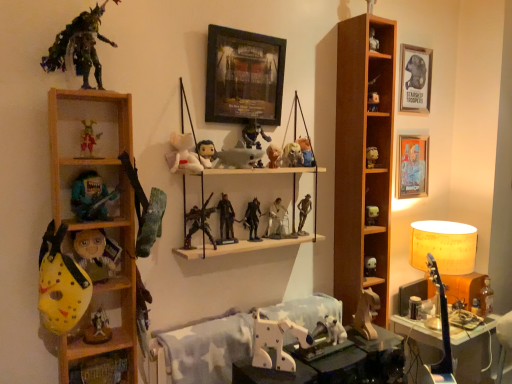
Question: Considering the relative sizes of white plastic walker at center, which ranks as the eleventh toy in bottom-to-top order, and matte plastic skull at center, which is counted as the 20th toy, starting from the bottom, in the image provided, is white plastic walker at center, which ranks as the eleventh toy in bottom-to-top order, bigger than matte plastic skull at center, which is counted as the 20th toy, starting from the bottom,?

Choices:
 (A) no
 (B) yes

Answer: (B)

Question: Does white plastic walker at center, which ranks as the eleventh toy in bottom-to-top order, have a greater height compared to matte plastic skull at center, the 5th toy viewed from the top?

Choices:
 (A) yes
 (B) no

Answer: (A)

Question: From a real-world perspective, is white plastic walker at center, which ranks as the eleventh toy in bottom-to-top order, beneath matte plastic skull at center, which is counted as the 20th toy, starting from the bottom?

Choices:
 (A) yes
 (B) no

Answer: (A)

Question: Is white plastic walker at center, which ranks as the eleventh toy in bottom-to-top order, to the right of matte plastic skull at center, the 5th toy viewed from the top, from the viewer's perspective?

Choices:
 (A) no
 (B) yes

Answer: (A)

Question: Is white plastic walker at center, which ranks as the eleventh toy in bottom-to-top order, aimed at matte plastic skull at center, the 5th toy viewed from the top?

Choices:
 (A) yes
 (B) no

Answer: (B)

Question: Based on their positions, is white matte figurine at upper right, acting as the 6th toy starting from the top, located to the left or right of white plastic table at lower center, marked as the 2th table in a back-to-front arrangement?

Choices:
 (A) right
 (B) left

Answer: (A)

Question: From the image's perspective, is white matte figurine at upper right, acting as the 6th toy starting from the top, located above or below white plastic table at lower center, positioned as the 2th table in right-to-left order?

Choices:
 (A) below
 (B) above

Answer: (B)

Question: Considering the positions of white matte figurine at upper right, the nineteenth toy ordered from the bottom, and white plastic table at lower center, which is the 1th table from front to back, in the image, is white matte figurine at upper right, the nineteenth toy ordered from the bottom, bigger or smaller than white plastic table at lower center, which is the 1th table from front to back,?

Choices:
 (A) small
 (B) big

Answer: (A)

Question: In the image, is white matte figurine at upper right, the nineteenth toy ordered from the bottom, positioned in front of or behind white plastic table at lower center, marked as the 2th table in a back-to-front arrangement?

Choices:
 (A) behind
 (B) front

Answer: (A)

Question: In terms of size, does white matte figurine at upper right, the nineteenth toy ordered from the bottom, appear bigger or smaller than matte plastic action figure at center, the 22th toy from the bottom?

Choices:
 (A) small
 (B) big

Answer: (A)

Question: From a real-world perspective, is white matte figurine at upper right, acting as the 6th toy starting from the top, positioned above or below matte plastic action figure at center, placed as the third toy when sorted from top to bottom?

Choices:
 (A) below
 (B) above

Answer: (A)

Question: Considering the positions of white matte figurine at upper right, acting as the 6th toy starting from the top, and matte plastic action figure at center, the 22th toy from the bottom, in the image, is white matte figurine at upper right, acting as the 6th toy starting from the top, wider or thinner than matte plastic action figure at center, the 22th toy from the bottom,?

Choices:
 (A) thin
 (B) wide

Answer: (A)

Question: Considering the positions of white matte figurine at upper right, the nineteenth toy ordered from the bottom, and matte plastic action figure at center, placed as the third toy when sorted from top to bottom, in the image, is white matte figurine at upper right, the nineteenth toy ordered from the bottom, taller or shorter than matte plastic action figure at center, placed as the third toy when sorted from top to bottom,?

Choices:
 (A) short
 (B) tall

Answer: (A)

Question: Considering the positions of white matte figurine at upper right, acting as the 6th toy starting from the top, and white matte figurine at center-right, the ninth toy positioned from the bottom, in the image, is white matte figurine at upper right, acting as the 6th toy starting from the top, bigger or smaller than white matte figurine at center-right, the ninth toy positioned from the bottom,?

Choices:
 (A) big
 (B) small

Answer: (A)

Question: In the image, is white matte figurine at upper right, the nineteenth toy ordered from the bottom, on the left side or the right side of white matte figurine at center-right, the ninth toy positioned from the bottom?

Choices:
 (A) left
 (B) right

Answer: (A)